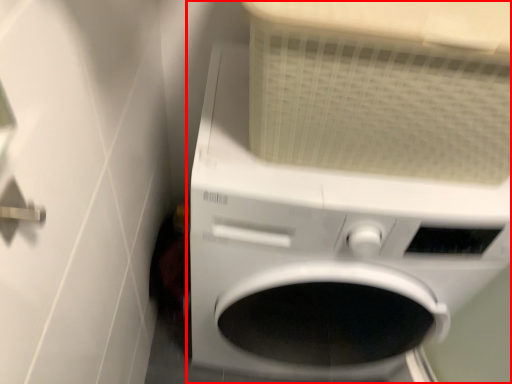
Question: From the image's perspective, where is washing machine (annotated by the red box) located in relation to door handle in the image?

Choices:
 (A) below
 (B) above

Answer: (A)